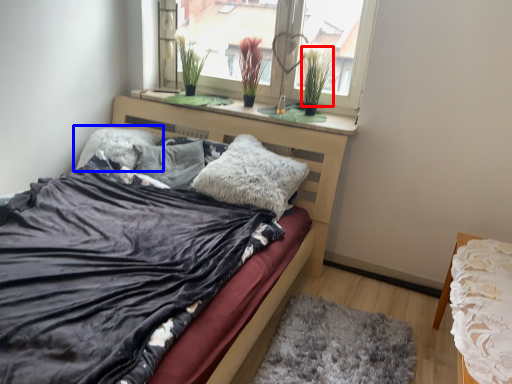
Question: Which object appears closest to the camera in this image, plant (highlighted by a red box) or pillow (highlighted by a blue box)?

Choices:
 (A) plant
 (B) pillow

Answer: (A)